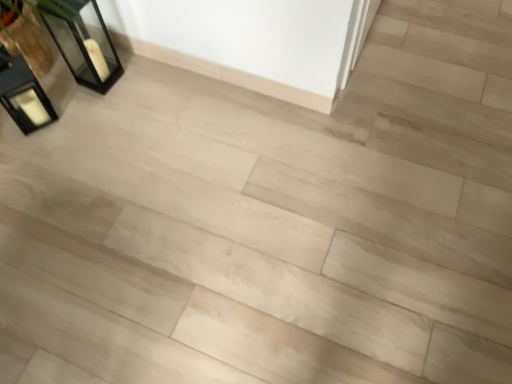
Identify the location of vacant space behind matte black lantern at left. This screenshot has height=384, width=512. (61, 80).